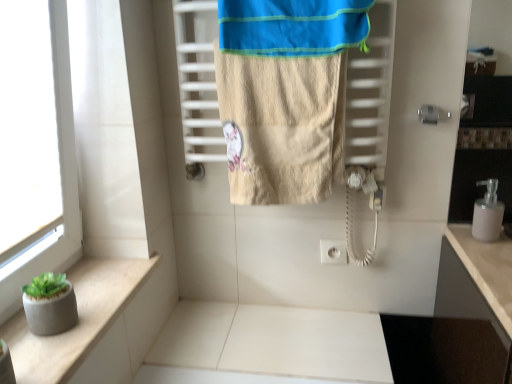
Where is `blue cotton beach towel at upper center`? This screenshot has height=384, width=512. blue cotton beach towel at upper center is located at coordinates (292, 27).

You are a GUI agent. You are given a task and a screenshot of the screen. Output one action in this format:
    pyautogui.click(x=<x>, y=<y>)
    Task: Click on the concrete planter at lower left
    
    Given the screenshot: What is the action you would take?
    pyautogui.click(x=79, y=319)

Looking at the image, does concrete planter at lower left seem bigger or smaller compared to blue cotton beach towel at upper center?

Considering their sizes, concrete planter at lower left takes up less space than blue cotton beach towel at upper center.

Considering the relative positions of concrete planter at lower left and blue cotton beach towel at upper center in the image provided, is concrete planter at lower left to the right of blue cotton beach towel at upper center from the viewer's perspective?

No, concrete planter at lower left is not to the right of blue cotton beach towel at upper center.

Is concrete planter at lower left further to camera compared to blue cotton beach towel at upper center?

No, it is in front of blue cotton beach towel at upper center.

Looking at this image, considering the sizes of objects beige textured towel at center and blue cotton beach towel at upper center in the image provided, who is wider, beige textured towel at center or blue cotton beach towel at upper center?

Wider between the two is blue cotton beach towel at upper center.

Relative to blue cotton beach towel at upper center, is beige textured towel at center in front or behind?

Visually, beige textured towel at center is located behind blue cotton beach towel at upper center.

From the image's perspective, is beige textured towel at center above or below blue cotton beach towel at upper center?

Based on their image positions, beige textured towel at center is located beneath blue cotton beach towel at upper center.

From a real-world perspective, between concrete planter at lower left and beige textured towel at center, who is vertically higher?

beige textured towel at center.

Is concrete planter at lower left oriented towards beige textured towel at center?

No, concrete planter at lower left is not oriented towards beige textured towel at center.

From the picture: Considering the sizes of concrete planter at lower left and beige textured towel at center in the image, is concrete planter at lower left taller or shorter than beige textured towel at center?

concrete planter at lower left is shorter than beige textured towel at center.

Looking at this image, can you tell me how much concrete planter at lower left and beige textured towel at center differ in facing direction?

There is a 92.1-degree angle between the facing directions of concrete planter at lower left and beige textured towel at center.

Image resolution: width=512 pixels, height=384 pixels. I want to click on soap dispenser that appears on the right of beige textured towel at center, so click(x=488, y=213).

From the image's perspective, does beige textured towel at center appear higher than pink matte soap dispenser at right?

Yes, from the image's perspective, beige textured towel at center is on top of pink matte soap dispenser at right.

Would you say beige textured towel at center contains pink matte soap dispenser at right?

No, pink matte soap dispenser at right is located outside of beige textured towel at center.

Which is in front, point (256, 33) or point (485, 183)?

The point (256, 33) is in front.

Considering the sizes of objects concrete planter at lower left and pink matte soap dispenser at right in the image provided, who is bigger, concrete planter at lower left or pink matte soap dispenser at right?

concrete planter at lower left is bigger.

Can you confirm if concrete planter at lower left is positioned to the right of pink matte soap dispenser at right?

No, concrete planter at lower left is not to the right of pink matte soap dispenser at right.

Considering their positions, is concrete planter at lower left located in front of or behind pink matte soap dispenser at right?

Visually, concrete planter at lower left is located in front of pink matte soap dispenser at right.

At what (x,y) coordinates should I click in order to perform the action: click on soap dispenser that appears above the concrete planter at lower left (from the image's perspective). Please return your answer as a coordinate pair (x, y). The width and height of the screenshot is (512, 384). Looking at the image, I should click on (488, 213).

Considering their positions, is blue cotton beach towel at upper center located in front of or behind beige textured towel at center?

Clearly, blue cotton beach towel at upper center is in front of beige textured towel at center.

Considering the positions of objects blue cotton beach towel at upper center and beige textured towel at center in the image provided, who is more to the left, blue cotton beach towel at upper center or beige textured towel at center?

beige textured towel at center is more to the left.

Is blue cotton beach towel at upper center next to beige textured towel at center and touching it?

Yes, blue cotton beach towel at upper center is beside beige textured towel at center.

Is there a large distance between pink matte soap dispenser at right and concrete planter at lower left?

pink matte soap dispenser at right is far away from concrete planter at lower left.

Is pink matte soap dispenser at right wider or thinner than concrete planter at lower left?

pink matte soap dispenser at right is thinner than concrete planter at lower left.

From a real-world perspective, is pink matte soap dispenser at right above or below concrete planter at lower left?

From a real-world perspective, pink matte soap dispenser at right is physically above concrete planter at lower left.

Which is nearer, (488, 240) or (81, 264)?

Positioned in front is point (488, 240).

Locate an element on the screen. The width and height of the screenshot is (512, 384). beach towel behind the concrete planter at lower left is located at coordinates [x=292, y=27].

In order to click on towel located below the blue cotton beach towel at upper center (from the image's perspective) in this screenshot , I will do `click(285, 94)`.

Which object lies nearer to the anchor point pink matte soap dispenser at right, beige textured towel at center or blue cotton beach towel at upper center?

beige textured towel at center is positioned closer to the anchor pink matte soap dispenser at right.

Looking at the image, which one is located further to concrete planter at lower left, beige textured towel at center or pink matte soap dispenser at right?

pink matte soap dispenser at right is positioned further to the anchor concrete planter at lower left.

Estimate the real-world distances between objects in this image. Which object is further from pink matte soap dispenser at right, concrete planter at lower left or beige textured towel at center?

Among the two, concrete planter at lower left is located further to pink matte soap dispenser at right.

Which object lies further to the anchor point concrete planter at lower left, beige textured towel at center or blue cotton beach towel at upper center?

blue cotton beach towel at upper center is positioned further to the anchor concrete planter at lower left.

Which object lies further to the anchor point concrete planter at lower left, pink matte soap dispenser at right or beige textured towel at center?

The object further to concrete planter at lower left is pink matte soap dispenser at right.

Considering their positions, is blue cotton beach towel at upper center positioned closer to concrete planter at lower left than pink matte soap dispenser at right?

Based on the image, blue cotton beach towel at upper center appears to be nearer to concrete planter at lower left.

From the image, which object appears to be nearer to blue cotton beach towel at upper center, concrete planter at lower left or pink matte soap dispenser at right?

Based on the image, pink matte soap dispenser at right appears to be nearer to blue cotton beach towel at upper center.

When comparing their distances from pink matte soap dispenser at right, does blue cotton beach towel at upper center or beige textured towel at center seem closer?

beige textured towel at center lies closer to pink matte soap dispenser at right than the other object.

At what (x,y) coordinates should I click in order to perform the action: click on towel between blue cotton beach towel at upper center and concrete planter at lower left in the vertical direction. Please return your answer as a coordinate pair (x, y). The width and height of the screenshot is (512, 384). Looking at the image, I should click on (285, 94).

At what (x,y) coordinates should I click in order to perform the action: click on beach towel situated between concrete planter at lower left and pink matte soap dispenser at right from left to right. Please return your answer as a coordinate pair (x, y). Looking at the image, I should click on (292, 27).

The width and height of the screenshot is (512, 384). What are the coordinates of `towel between concrete planter at lower left and pink matte soap dispenser at right from left to right` in the screenshot? It's located at (285, 94).

What are the coordinates of `beach towel between beige textured towel at center and pink matte soap dispenser at right in the horizontal direction` in the screenshot? It's located at (292, 27).